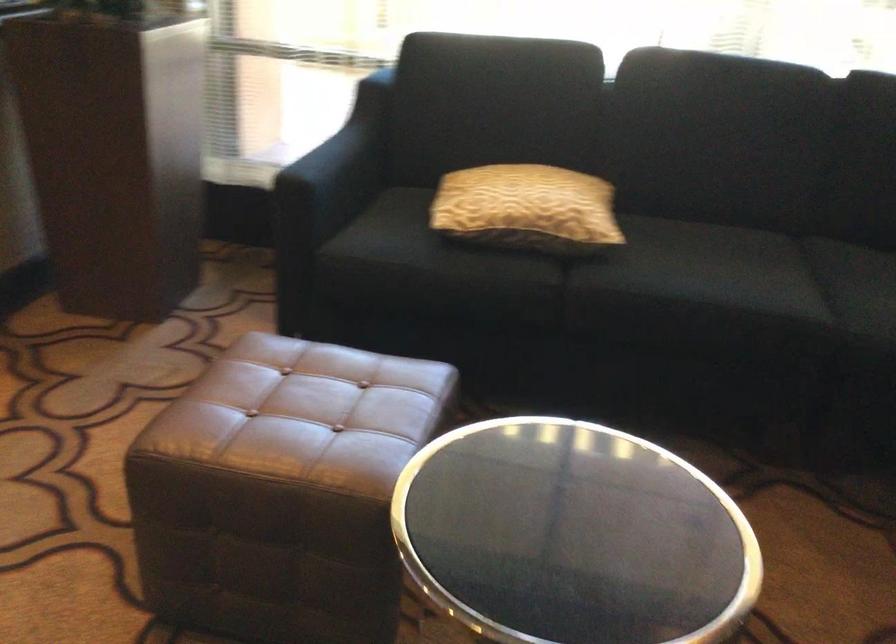
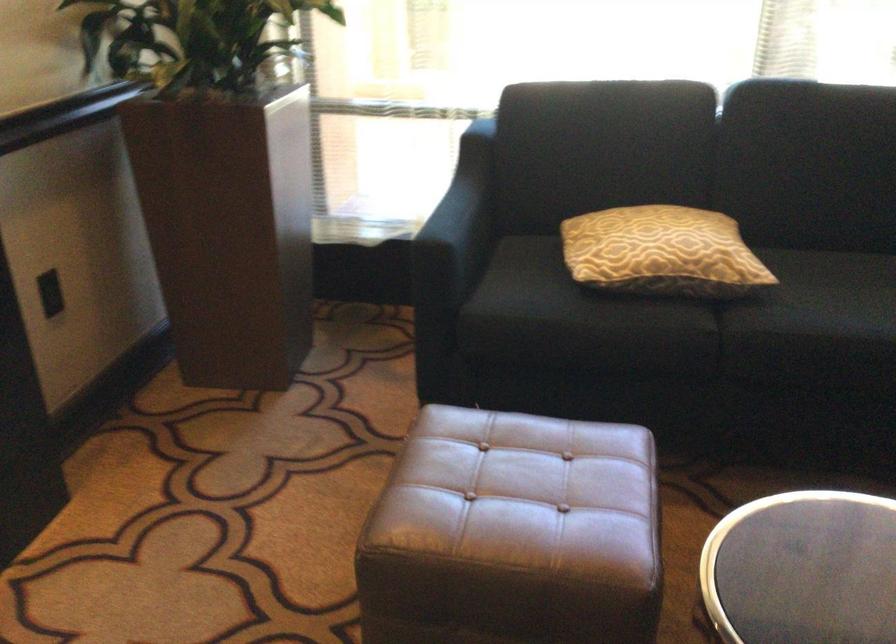
In the second image, find the point that corresponds to pixel 519 207 in the first image.

(661, 252)